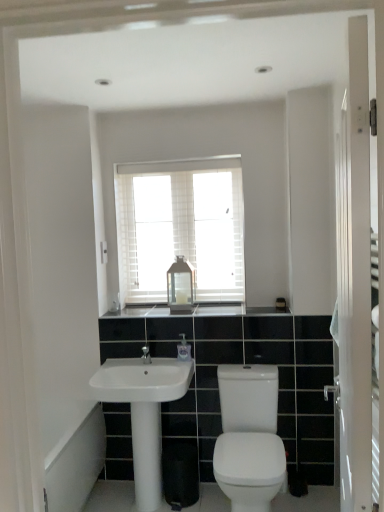
Locate an element on the screen. free point below white glossy pedestal at center (from a real-world perspective) is located at coordinates pyautogui.click(x=142, y=505).